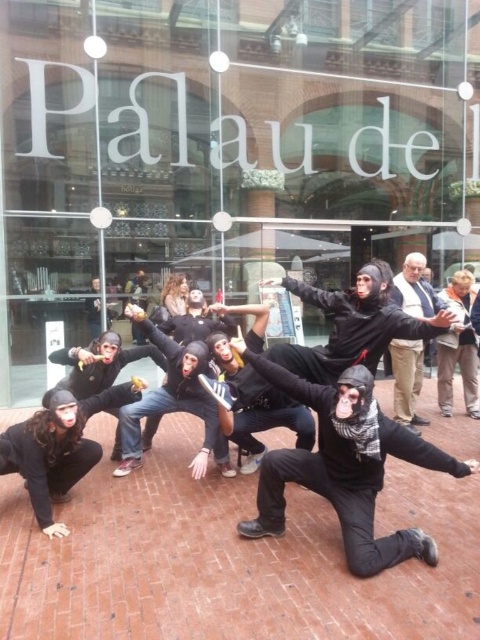
Question: Does transparent glass shop window at center have a smaller size compared to khaki cotton pants at center?

Choices:
 (A) yes
 (B) no

Answer: (B)

Question: Which of the following is the closest to the observer?

Choices:
 (A) matte black mask at lower left
 (B) transparent glass shop window at center

Answer: (A)

Question: Which point is closer to the camera?

Choices:
 (A) (183, 45)
 (B) (406, 372)

Answer: (B)

Question: From the image, what is the correct spatial relationship of transparent glass shop window at center in relation to matte black mask at lower left?

Choices:
 (A) right
 (B) left

Answer: (A)

Question: Is transparent glass shop window at center bigger than khaki cotton pants at center?

Choices:
 (A) yes
 (B) no

Answer: (A)

Question: Considering the real-world distances, which object is farthest from the khaki cotton pants at center?

Choices:
 (A) transparent glass shop window at center
 (B) matte black mask at lower left

Answer: (A)